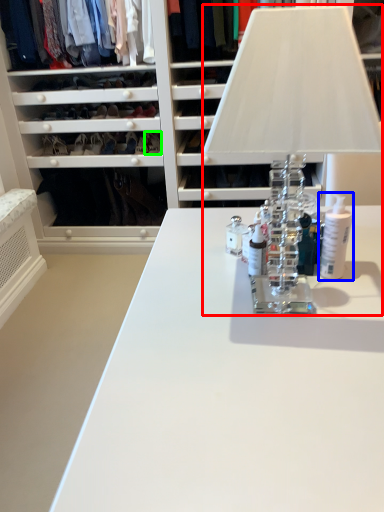
Question: Which object is positioned farthest from table lamp (highlighted by a red box)? Select from toiletry (highlighted by a blue box) and shoe (highlighted by a green box).

Choices:
 (A) toiletry
 (B) shoe

Answer: (B)